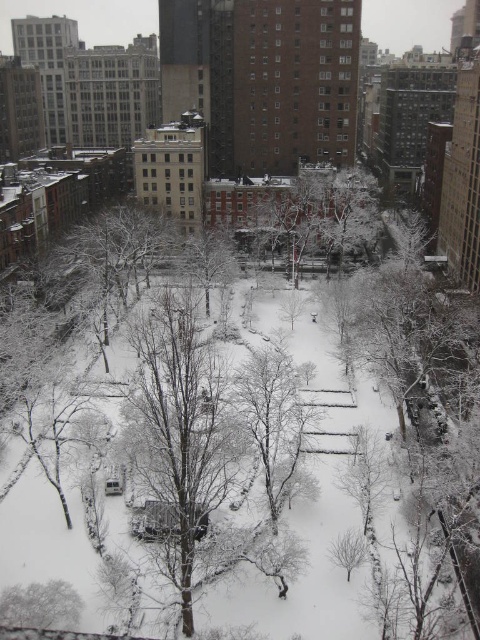
Can you confirm if bare wood tree at center is thinner than brown textured tree at center?

No, bare wood tree at center is not thinner than brown textured tree at center.

Can you confirm if bare wood tree at center is bigger than brown textured tree at center?

Indeed, bare wood tree at center has a larger size compared to brown textured tree at center.

Does point (180, 356) come closer to viewer compared to point (193, 246)?

Yes, it is.

The width and height of the screenshot is (480, 640). I want to click on bare wood tree at center, so click(x=180, y=433).

In the scene shown: Can you confirm if snow-covered tree at lower left is thinner than brown textured tree at center?

Indeed, snow-covered tree at lower left has a lesser width compared to brown textured tree at center.

Between snow-covered tree at lower left and brown textured tree at center, which one is positioned lower?

snow-covered tree at lower left is lower down.

What are the coordinates of `snow-covered tree at lower left` in the screenshot? It's located at (40, 605).

Is snow-covered tree at center shorter than snow-covered tree at lower left?

No.

Who is positioned more to the right, snow-covered tree at center or snow-covered tree at lower left?

Positioned to the right is snow-covered tree at center.

Is point (279, 474) in front of point (45, 609)?

No, it is behind (45, 609).

Find the location of a particular element. The height and width of the screenshot is (640, 480). snow-covered tree at center is located at coordinates (273, 419).